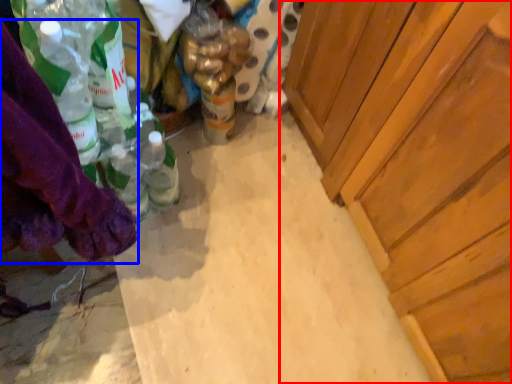
Question: Which point is further to the camera, cabinetry (highlighted by a red box) or clothing (highlighted by a blue box)?

Choices:
 (A) cabinetry
 (B) clothing

Answer: (A)